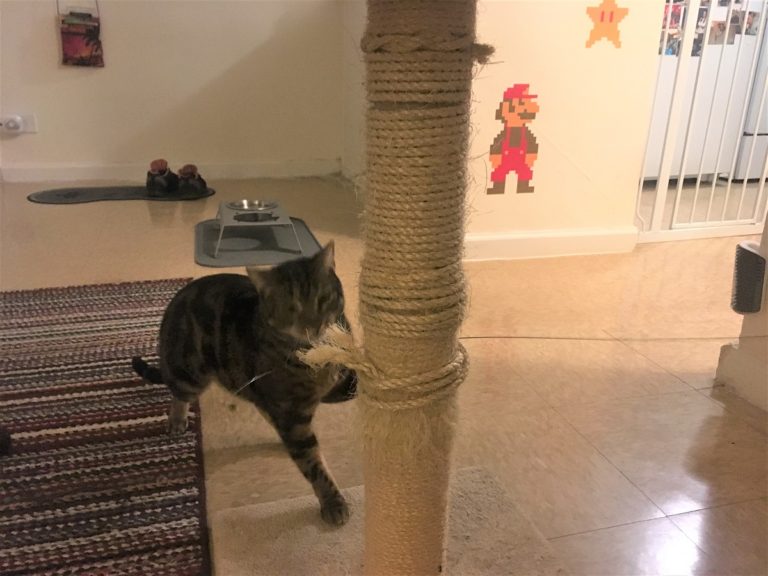
Find the location of a particular element. Image resolution: width=768 pixels, height=576 pixels. scratching post stick on for cat is located at coordinates (746, 278).